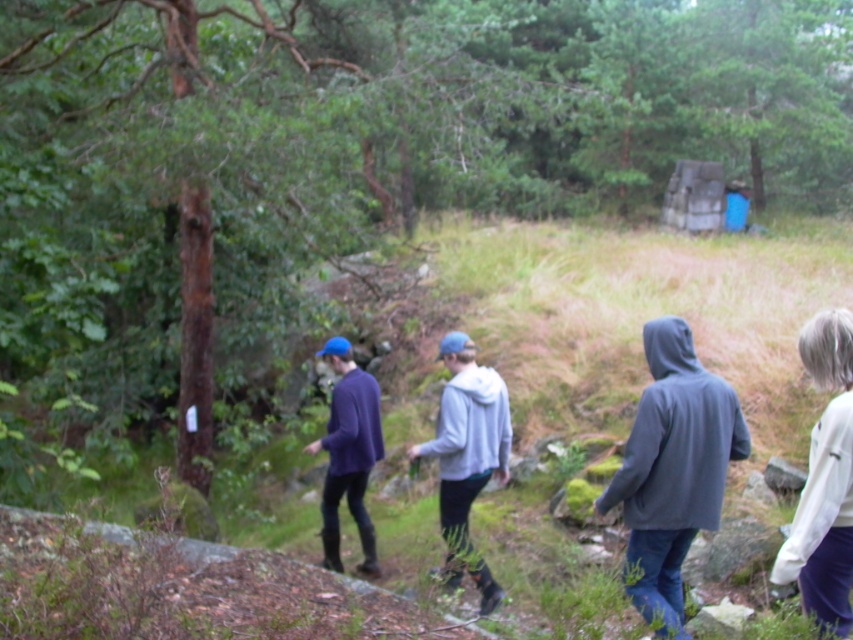
You are planning to take a photo of the group in the woods. You want to ensure both the white soft sweater at right and the gray hoodie at center are clearly visible. Considering their sizes, which one might you need to adjust your camera focus on more carefully to avoid blurriness?

The white soft sweater at right is smaller than the gray hoodie at center, so you might need to adjust your camera focus more carefully on the white soft sweater at right to avoid blurriness due to its smaller size.

You are standing in a forested area and want to reach a specific point marked at coordinates point (637, 460). If you can walk 6 meters in one minute, how long will it take you to reach that point?

The distance between you and point (637, 460) is 6.26 meters. Since you can walk 6 meters in one minute, it will take approximately 1 minute and 3 seconds to reach the point.

You are a photographer trying to capture a candid shot of the two people in the scene wearing the dark gray hoodie at center and the matte purple sweater at center. Your camera has a maximum focus range of 10 feet. Can you capture both subjects in focus without moving closer?

The distance between the dark gray hoodie at center and the matte purple sweater at center is 10.75 feet. Since the camera can only focus up to 10 feet, the subjects are slightly out of the focus range. You would need to move closer to reduce the distance between them to within 10 feet for both to be in focus.